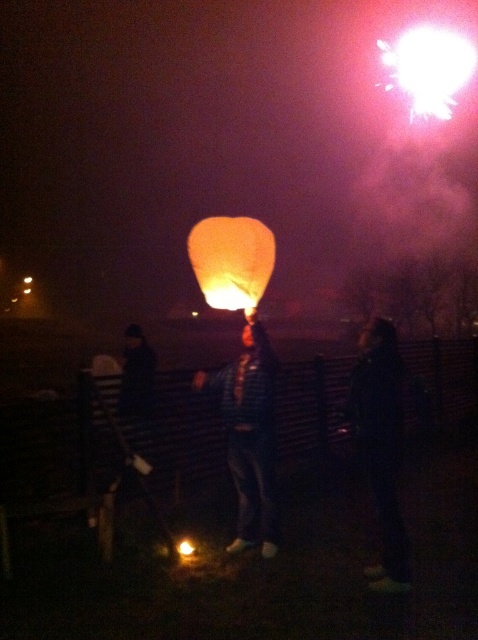
You are a photographer trying to capture the striped fabric pants at center and the matte orange paper lantern at center in a single shot. Based on their positions, will the lantern appear above or below the pants in the photo?

The striped fabric pants at center is below the matte orange paper lantern at center, so the lantern will appear above the pants in the photo.

You are a photographer trying to capture the lantern release. You notice two points in the image at coordinates point (x=225, y=372) and point (x=430, y=112). Which point should you focus on to ensure the closer object is in sharp focus?

Point (x=225, y=372) is closer to the camera than point (x=430, y=112), so you should focus on point (x=225, y=372) to ensure the closer object is in sharp focus.